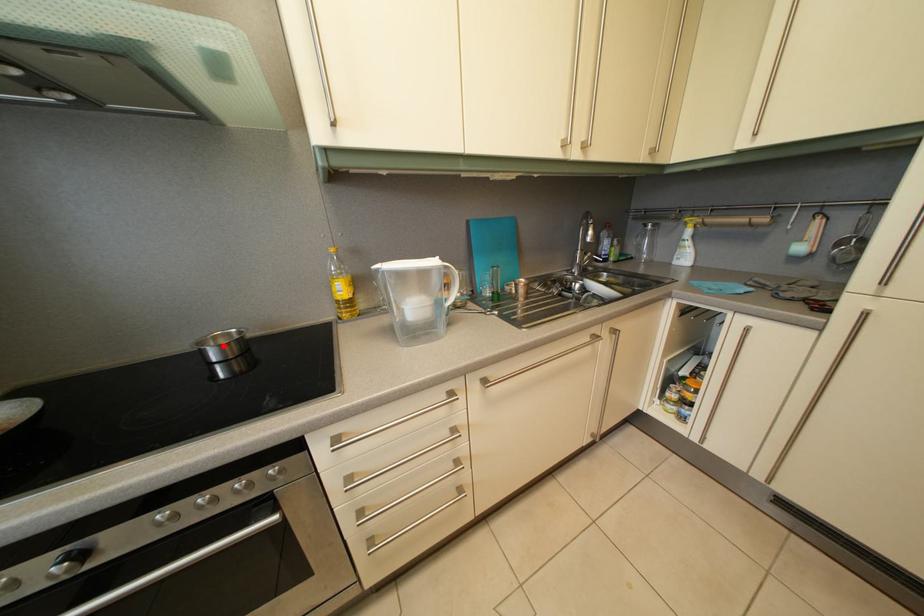
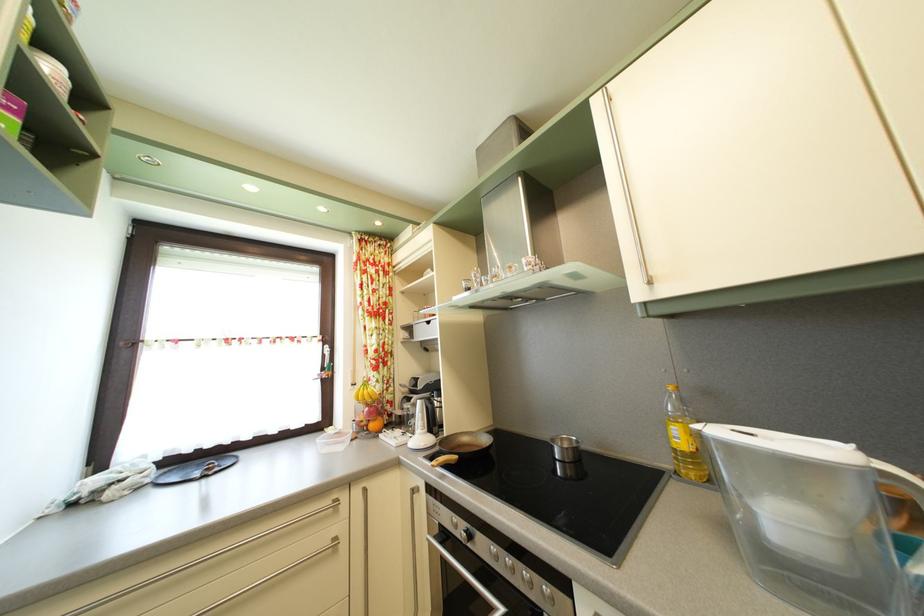
Where in the second image is the point corresponding to the highlighted location from the first image?

(569, 448)